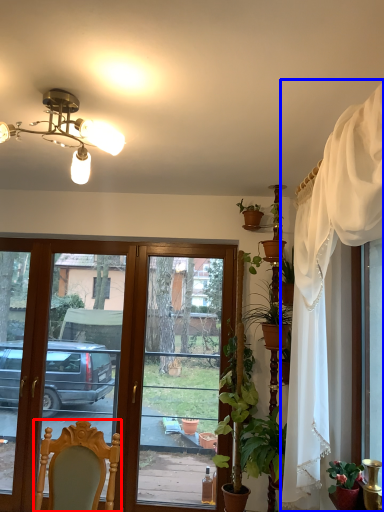
Question: Among these objects, which one is farthest to the camera, chair (highlighted by a red box) or curtain (highlighted by a blue box)?

Choices:
 (A) chair
 (B) curtain

Answer: (A)